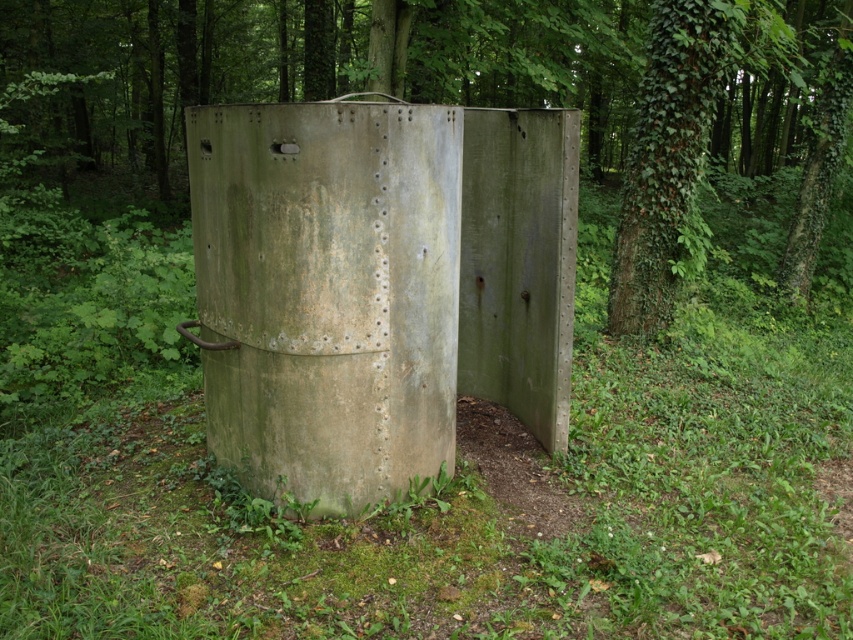
Question: Which of the following is the closest to the observer?

Choices:
 (A) (556, 148)
 (B) (685, 49)

Answer: (A)

Question: Is green matte bunker at center to the left of green ivy-covered tree at upper right from the viewer's perspective?

Choices:
 (A) yes
 (B) no

Answer: (A)

Question: Which point appears closest to the camera in this image?

Choices:
 (A) (651, 148)
 (B) (512, 349)

Answer: (B)

Question: Which of the following is the farthest from the observer?

Choices:
 (A) (315, 205)
 (B) (697, 108)

Answer: (B)

Question: Does green matte bunker at center have a lesser width compared to green ivy-covered tree at upper right?

Choices:
 (A) yes
 (B) no

Answer: (B)

Question: Can you confirm if green matte bunker at center is thinner than green ivy-covered tree at upper right?

Choices:
 (A) yes
 (B) no

Answer: (B)